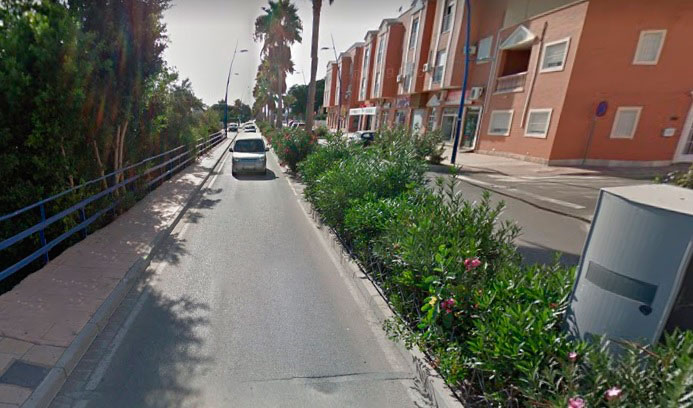
Locate an element on the screen. walk way is located at coordinates (77, 281).